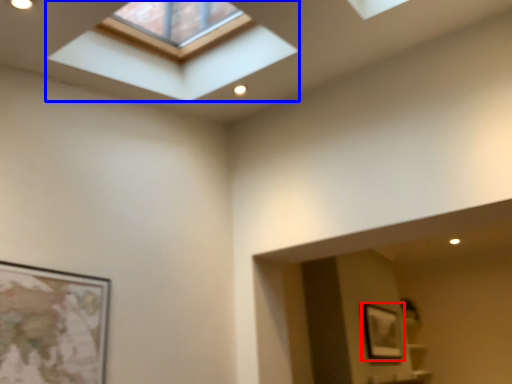
Question: Which object is further to the camera taking this photo, picture frame (highlighted by a red box) or window (highlighted by a blue box)?

Choices:
 (A) picture frame
 (B) window

Answer: (A)